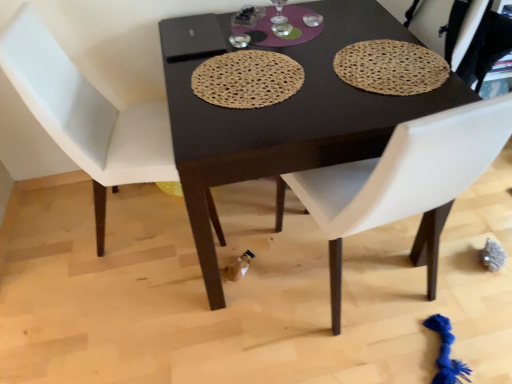
Locate an element on the screen. vacant area situated below white leather chair at left, the 2th chair positioned from the right (from a real-world perspective) is located at coordinates (145, 220).